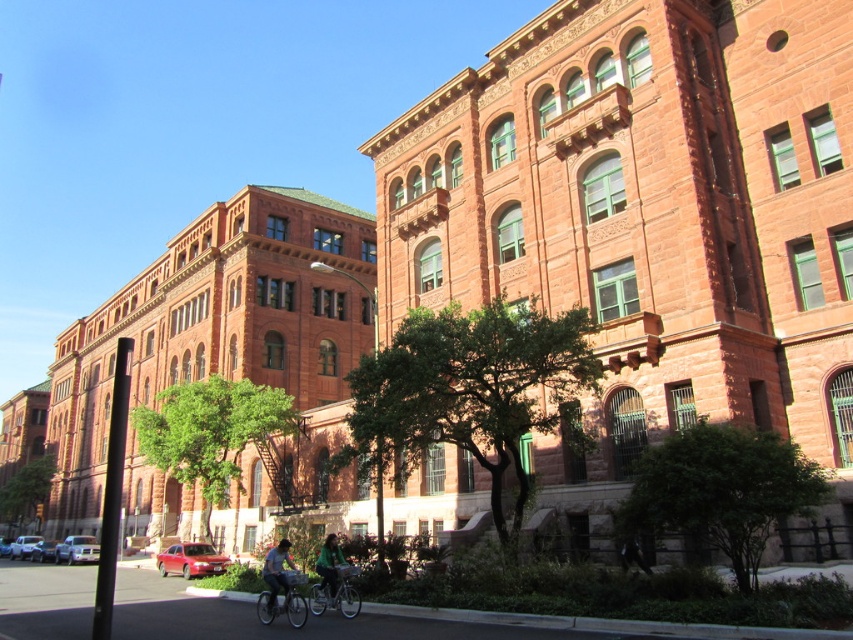
Question: Considering the real-world distances, which object is closest to the green matte jacket at lower center?

Choices:
 (A) green fabric jacket at lower center
 (B) silver metallic bicycle at lower center
 (C) green matte bicycle at center

Answer: (C)

Question: Among these objects, which one is nearest to the camera?

Choices:
 (A) silver metallic bicycle at lower center
 (B) green fabric jacket at lower center

Answer: (A)

Question: Is green fabric jacket at lower center positioned before green matte jacket at lower center?

Choices:
 (A) no
 (B) yes

Answer: (B)

Question: Where is silver metallic bicycle at lower center located in relation to green fabric jacket at lower center in the image?

Choices:
 (A) below
 (B) above

Answer: (A)

Question: Considering the relative positions of green matte bicycle at center and green fabric jacket at lower center in the image provided, where is green matte bicycle at center located with respect to green fabric jacket at lower center?

Choices:
 (A) above
 (B) below

Answer: (B)

Question: Which point is farther to the camera?

Choices:
 (A) (318, 564)
 (B) (281, 588)
 (C) (326, 604)

Answer: (A)